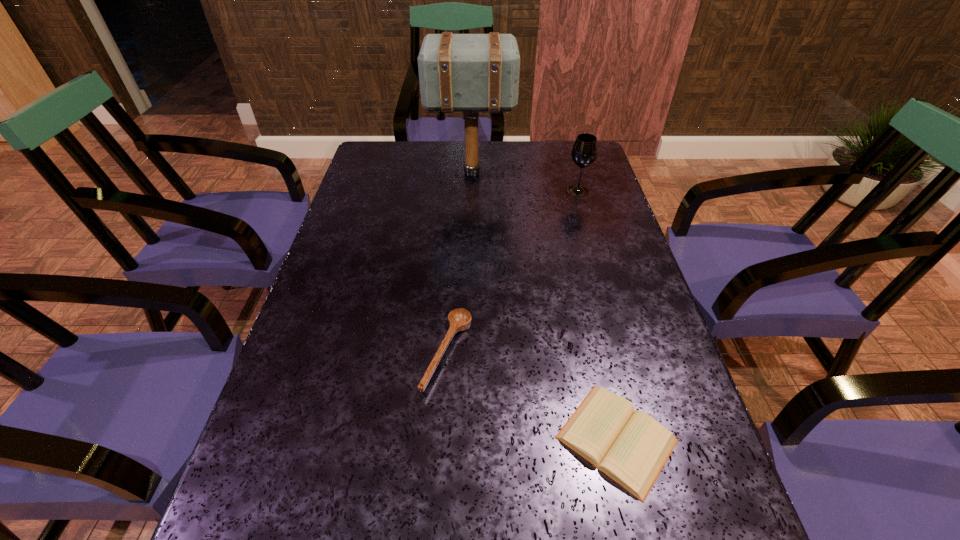
You are a GUI agent. You are given a task and a screenshot of the screen. Output one action in this format:
    pyautogui.click(x=<x>, y=<y>)
    Task: Click on the free spot that satisfies the following two spatial constraints: 1. on the striking surface of the tallest object; 2. on the right side of the second tallest object
    
    Given the screenshot: What is the action you would take?
    pyautogui.click(x=470, y=191)

Image resolution: width=960 pixels, height=540 pixels. Identify the location of free spot that satisfies the following two spatial constraints: 1. on the striking surface of the diary; 2. on the left side of the tallest object. (464, 439).

This screenshot has height=540, width=960. Find the location of `vacant point that satisfies the following two spatial constraints: 1. on the striking surface of the wineglass; 2. on the right side of the mallet`. vacant point that satisfies the following two spatial constraints: 1. on the striking surface of the wineglass; 2. on the right side of the mallet is located at coordinates (470, 191).

At what (x,y) coordinates should I click in order to perform the action: click on vacant area that satisfies the following two spatial constraints: 1. on the striking surface of the shortest object; 2. on the right side of the mallet. Please return your answer as a coordinate pair (x, y). Looking at the image, I should click on (464, 439).